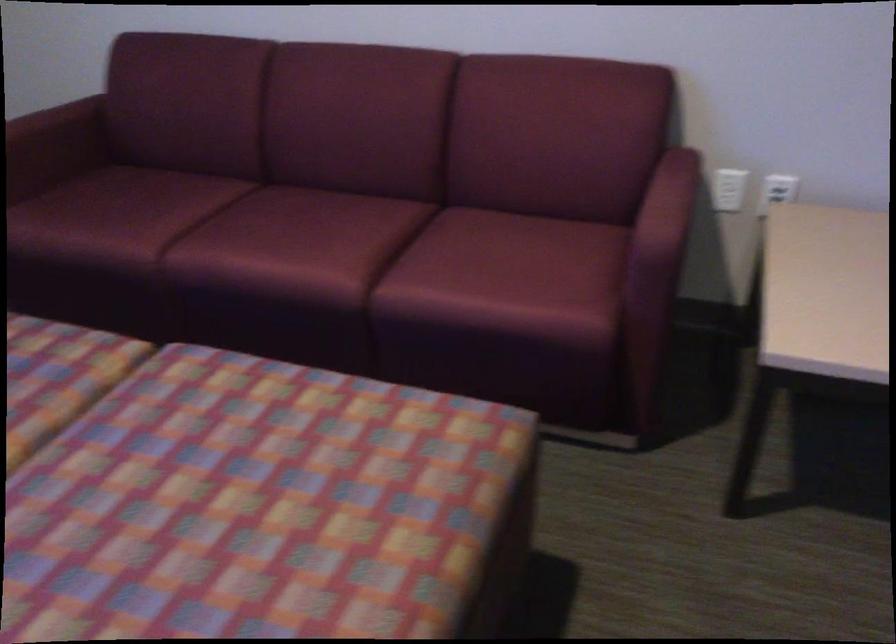
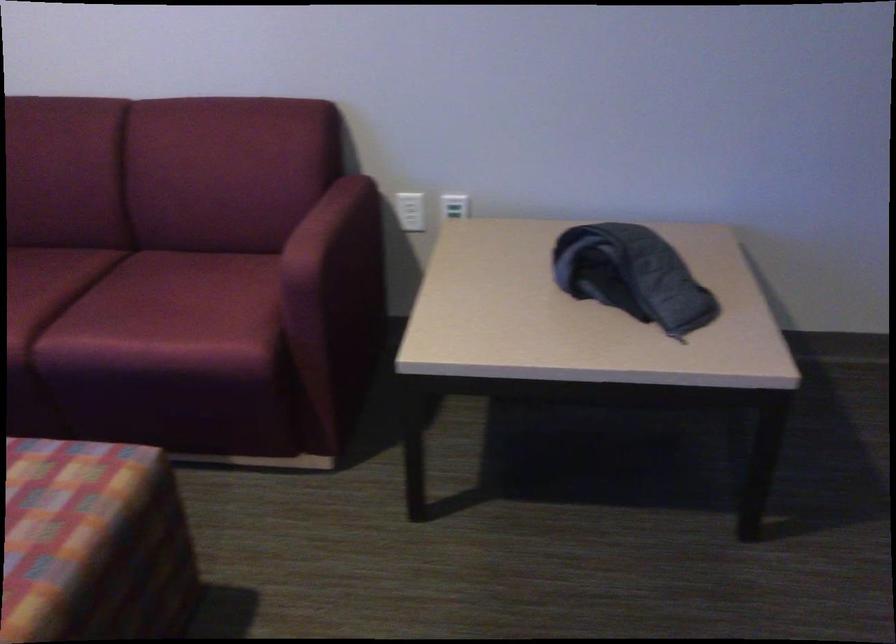
The point at (x=495, y=500) is marked in the first image. Where is the corresponding point in the second image?

(93, 544)